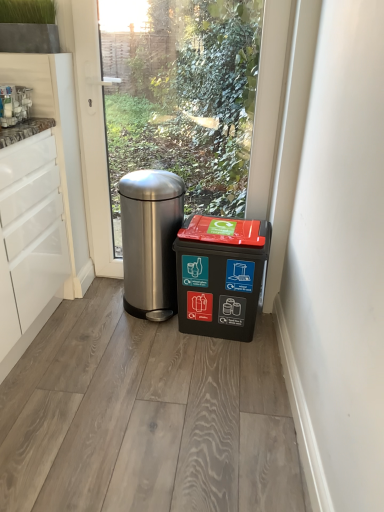
Question: Which direction should I rotate to look at polished stainless steel trash can at center, positioned as the first waste container in left-to-right order?

Choices:
 (A) left
 (B) right

Answer: (A)

Question: Is polished stainless steel trash can at center, the 2th waste container in the right-to-left sequence, aimed at black plastic recycling bin at lower right, acting as the first waste container starting from the right?

Choices:
 (A) no
 (B) yes

Answer: (A)

Question: Does polished stainless steel trash can at center, positioned as the first waste container in left-to-right order, have a greater height compared to black plastic recycling bin at lower right, acting as the first waste container starting from the right?

Choices:
 (A) yes
 (B) no

Answer: (A)

Question: Is polished stainless steel trash can at center, the 2th waste container in the right-to-left sequence, touching black plastic recycling bin at lower right, which appears as the second waste container when viewed from the left?

Choices:
 (A) no
 (B) yes

Answer: (A)

Question: Is there a large distance between polished stainless steel trash can at center, the 2th waste container in the right-to-left sequence, and black plastic recycling bin at lower right, which appears as the second waste container when viewed from the left?

Choices:
 (A) yes
 (B) no

Answer: (B)

Question: From a real-world perspective, is polished stainless steel trash can at center, positioned as the first waste container in left-to-right order, physically below black plastic recycling bin at lower right, acting as the first waste container starting from the right?

Choices:
 (A) yes
 (B) no

Answer: (B)

Question: Is polished stainless steel trash can at center, positioned as the first waste container in left-to-right order, turned away from black plastic recycling bin at lower right, acting as the first waste container starting from the right?

Choices:
 (A) yes
 (B) no

Answer: (B)

Question: Are black plastic recycling bin at lower right, which appears as the second waste container when viewed from the left, and polished stainless steel trash can at center, positioned as the first waste container in left-to-right order, far apart?

Choices:
 (A) yes
 (B) no

Answer: (B)

Question: Does black plastic recycling bin at lower right, which appears as the second waste container when viewed from the left, have a lesser height compared to polished stainless steel trash can at center, the 2th waste container in the right-to-left sequence?

Choices:
 (A) no
 (B) yes

Answer: (B)

Question: Considering the relative sizes of black plastic recycling bin at lower right, acting as the first waste container starting from the right, and polished stainless steel trash can at center, positioned as the first waste container in left-to-right order, in the image provided, is black plastic recycling bin at lower right, acting as the first waste container starting from the right, taller than polished stainless steel trash can at center, positioned as the first waste container in left-to-right order,?

Choices:
 (A) no
 (B) yes

Answer: (A)

Question: Considering the relative positions of black plastic recycling bin at lower right, acting as the first waste container starting from the right, and polished stainless steel trash can at center, the 2th waste container in the right-to-left sequence, in the image provided, is black plastic recycling bin at lower right, acting as the first waste container starting from the right, in front of polished stainless steel trash can at center, the 2th waste container in the right-to-left sequence,?

Choices:
 (A) no
 (B) yes

Answer: (B)

Question: Is black plastic recycling bin at lower right, which appears as the second waste container when viewed from the left, looking in the opposite direction of polished stainless steel trash can at center, positioned as the first waste container in left-to-right order?

Choices:
 (A) no
 (B) yes

Answer: (A)

Question: From the image's perspective, is black plastic recycling bin at lower right, acting as the first waste container starting from the right, below polished stainless steel trash can at center, positioned as the first waste container in left-to-right order?

Choices:
 (A) yes
 (B) no

Answer: (A)

Question: Looking at the image, does polished stainless steel trash can at center, positioned as the first waste container in left-to-right order, seem bigger or smaller compared to black plastic recycling bin at lower right, acting as the first waste container starting from the right?

Choices:
 (A) small
 (B) big

Answer: (B)